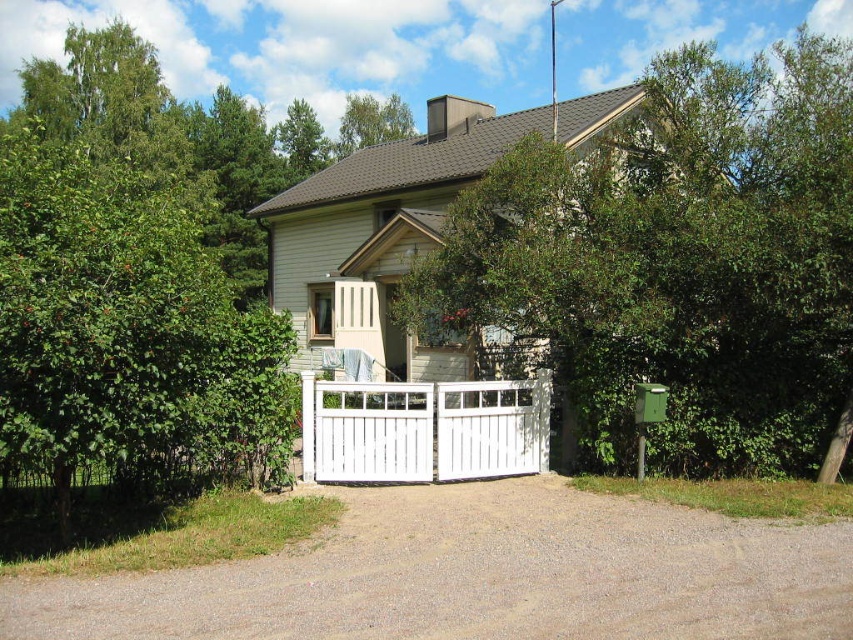
Which is in front, point (463, 192) or point (527, 404)?

Positioned in front is point (527, 404).

Which is below, green leafy tree at upper center or white wooden gate at center?

white wooden gate at center is lower down.

The width and height of the screenshot is (853, 640). Identify the location of green leafy tree at upper center. (679, 262).

What are the coordinates of `green leafy tree at upper center` in the screenshot? It's located at (679, 262).

Who is taller, green leafy tree at upper center or brown gravel driveway at center?

green leafy tree at upper center is taller.

Is point (585, 376) behind point (651, 621)?

Yes, it is behind point (651, 621).

Where is `green leafy tree at upper center`? green leafy tree at upper center is located at coordinates (679, 262).

Can you confirm if brown gravel driveway at center is positioned to the left of white wooden gate at center?

Indeed, brown gravel driveway at center is positioned on the left side of white wooden gate at center.

Between brown gravel driveway at center and white wooden gate at center, which one appears on the left side from the viewer's perspective?

brown gravel driveway at center

Image resolution: width=853 pixels, height=640 pixels. What do you see at coordinates (479, 576) in the screenshot? I see `brown gravel driveway at center` at bounding box center [479, 576].

The image size is (853, 640). I want to click on brown gravel driveway at center, so click(479, 576).